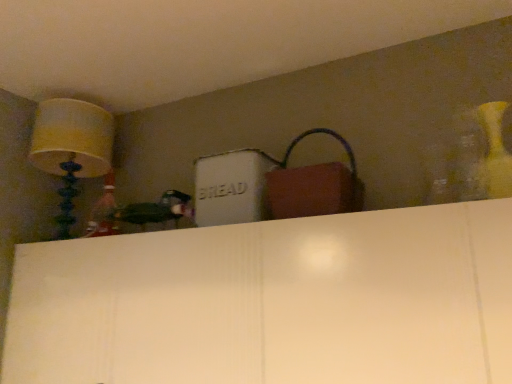
Question: Does matte yellow lampshade at upper left have a greater height compared to matte brown handbag at upper center?

Choices:
 (A) yes
 (B) no

Answer: (A)

Question: Can you confirm if matte yellow lampshade at upper left is smaller than matte brown handbag at upper center?

Choices:
 (A) yes
 (B) no

Answer: (B)

Question: From a real-world perspective, is matte yellow lampshade at upper left below matte brown handbag at upper center?

Choices:
 (A) no
 (B) yes

Answer: (A)

Question: Is matte yellow lampshade at upper left at the right side of matte brown handbag at upper center?

Choices:
 (A) yes
 (B) no

Answer: (B)

Question: From the image's perspective, does matte yellow lampshade at upper left appear lower than matte brown handbag at upper center?

Choices:
 (A) yes
 (B) no

Answer: (B)

Question: Does matte yellow lampshade at upper left contain matte brown handbag at upper center?

Choices:
 (A) no
 (B) yes

Answer: (A)

Question: Is matte brown handbag at upper center placed right next to matte yellow lampshade at upper left?

Choices:
 (A) yes
 (B) no

Answer: (B)

Question: Does matte brown handbag at upper center appear on the left side of matte yellow lampshade at upper left?

Choices:
 (A) yes
 (B) no

Answer: (B)

Question: Is matte brown handbag at upper center shorter than matte yellow lampshade at upper left?

Choices:
 (A) no
 (B) yes

Answer: (B)

Question: Considering the relative sizes of matte brown handbag at upper center and matte yellow lampshade at upper left in the image provided, is matte brown handbag at upper center thinner than matte yellow lampshade at upper left?

Choices:
 (A) yes
 (B) no

Answer: (A)

Question: Considering the relative sizes of matte brown handbag at upper center and matte yellow lampshade at upper left in the image provided, is matte brown handbag at upper center bigger than matte yellow lampshade at upper left?

Choices:
 (A) yes
 (B) no

Answer: (B)

Question: Considering the relative sizes of matte brown handbag at upper center and matte yellow lampshade at upper left in the image provided, is matte brown handbag at upper center taller than matte yellow lampshade at upper left?

Choices:
 (A) no
 (B) yes

Answer: (A)

Question: Is matte yellow lampshade at upper left to the left or to the right of matte brown handbag at upper center in the image?

Choices:
 (A) right
 (B) left

Answer: (B)